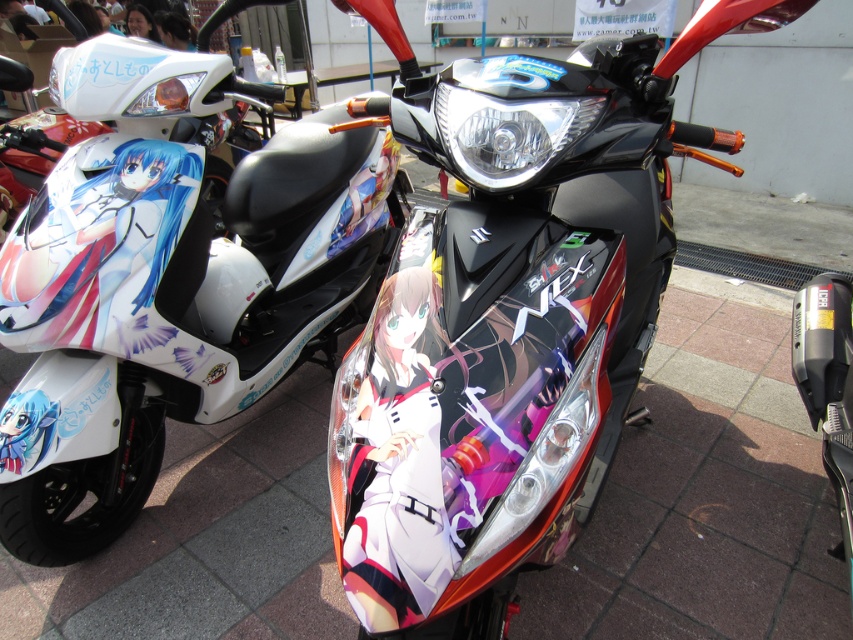
You are standing in front of two custom scooters. You notice two points marked on the scooters. The first point is at coordinates point (x=527, y=552) and the second point is at point (x=25, y=547). Which point is closer to you?

Point (x=527, y=552) is closer to the camera than point (x=25, y=547).

You are planning to park your vehicle in a narrow alley that can only accommodate vehicles up to 1.8 meters in width. Given that you have a glossy black motorcycle at center and a white glossy scooter at left, which one would be more suitable to park in the alley based on their widths?

The white glossy scooter at left is more suitable because the glossy black motorcycle at center is wider than the white glossy scooter at left, exceeding the alley width limit.

You are standing in front of two scooters. You see a point at coordinates (x=515, y=308). Which object does this point belong to?

The point at coordinates (x=515, y=308) belongs to the glossy black motorcycle at center.